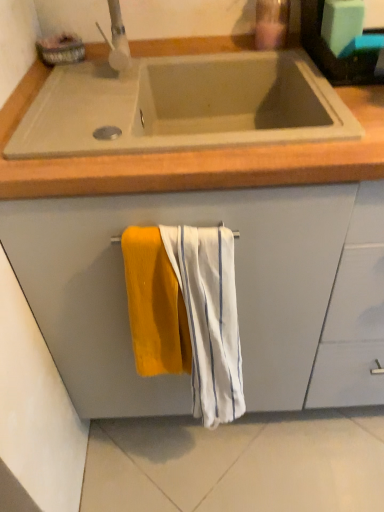
Identify the location of vacant region to the left of translucent plastic soap dispenser at upper center. (211, 51).